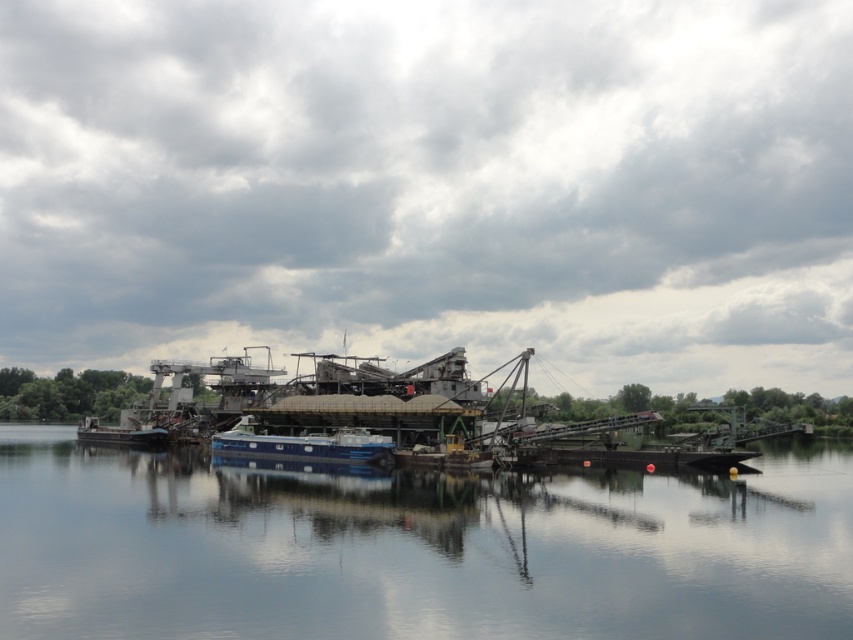
You are navigating a narrow channel between two industrial barges. You see a blue matte boat at center and a blue metallic barge at center. Which one should you steer your vessel away from to avoid collision?

You should steer away from the blue metallic barge at center because the blue matte boat at center is positioned to its right, meaning the barge is closer to the left side of your path, requiring you to avoid collision with it.

You are standing on the industrial barge and looking around. Where is the smooth blue water at center located?

The smooth blue water at center is located at point (415, 548).